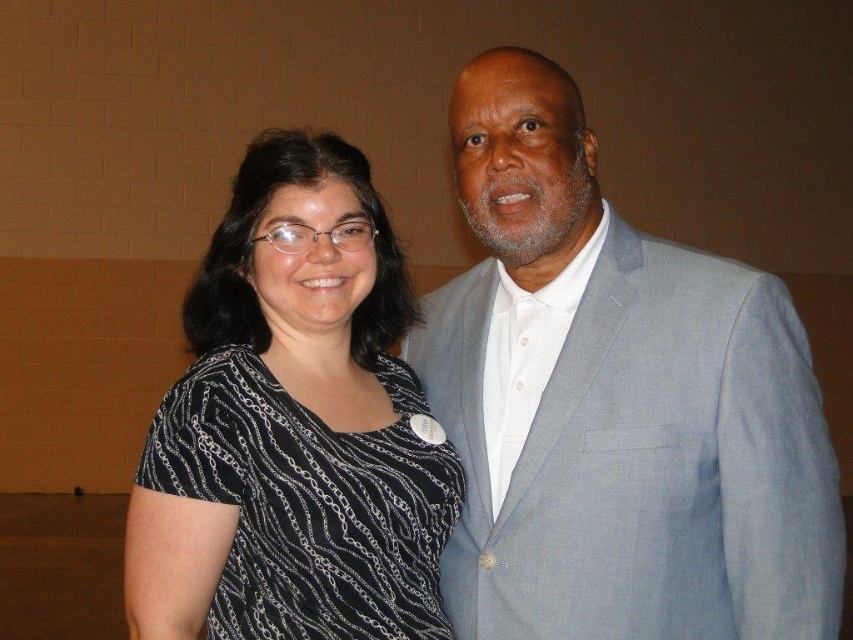
You are standing in the same room as the two people in the image. You want to place a small sticker exactly at the point with coordinates point (614, 404). Where on the gray textured suit at center should you place it?

The point (614, 404) is located on the gray textured suit at center, so you should place the sticker there.

From the picture: You are a photographer setting up for a group photo. You need to ensure there is enough space between the gray textured suit at center and the black printed shirt at left for a proper composition. The minimum required distance for this composition is 10 inches. Can the current spacing between them work?

The gray textured suit at center is 10.36 inches from the black printed shirt at left, which exceeds the minimum required distance of 10 inches. Therefore, the current spacing between them works for the composition.

You are at a formal event and need to greet someone. You see the gray textured suit at center and the black printed shirt at left. Which one is closer to you?

The black printed shirt at left is behind the gray textured suit at center, so the gray textured suit at center is closer to you.